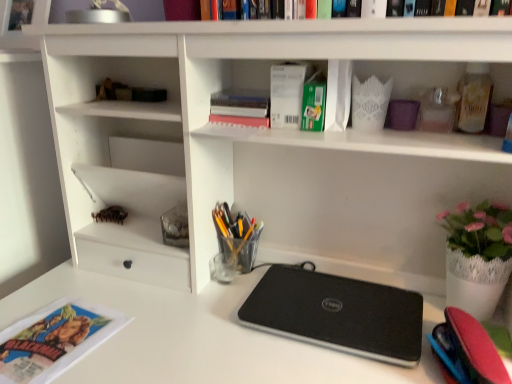
I want to click on free location above matte paper magazine at lower left (from a real-world perspective), so click(x=51, y=339).